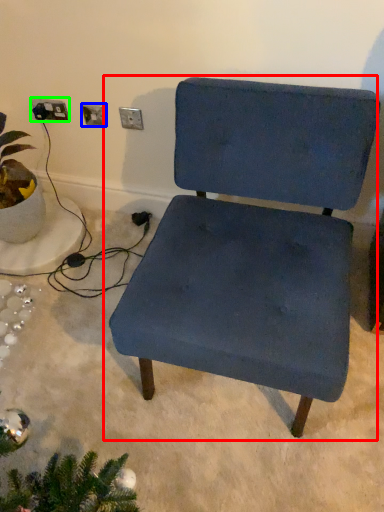
Question: Based on their relative distances, which object is farther from chair (highlighted by a red box)? Choose from electric outlet (highlighted by a blue box) and electric outlet (highlighted by a green box).

Choices:
 (A) electric outlet
 (B) electric outlet

Answer: (B)